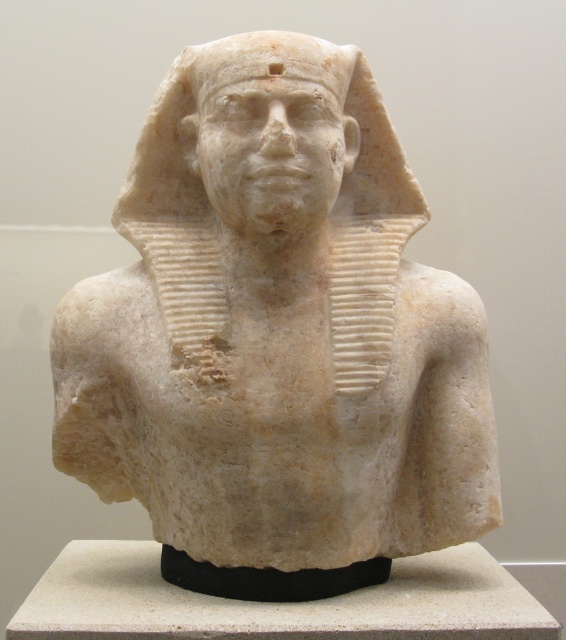
You are an art conservator examining the white marble bust at center and the white marble head at center. Which part of the sculpture is wider?

The white marble bust at center is wider than the white marble head at center according to the description provided.

You are standing in front of the marble bust of an ancient Egyptian figure. There is a specific point at coordinates point (x=273, y=140) that you want to examine closely. If you extend your arm fully, which typically reaches about 2.5 feet from your body, will you be able to touch that point?

The distance between you and point (x=273, y=140) is 3.53 feet, which is greater than the 2.5 feet your arm can reach. Therefore, you cannot touch the point with your arm extended fully.

Based on the scene description, which object is positioned lower in the image? The white marble bust at center or the white marble head at center?

The white marble bust at center is located below the white marble head at center, so the white marble bust at center is positioned lower in the image.